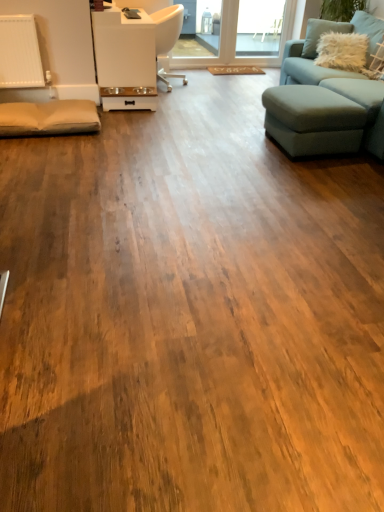
In order to click on vacant region to the left of light blue fabric footrest at right in this screenshot , I will do `click(238, 139)`.